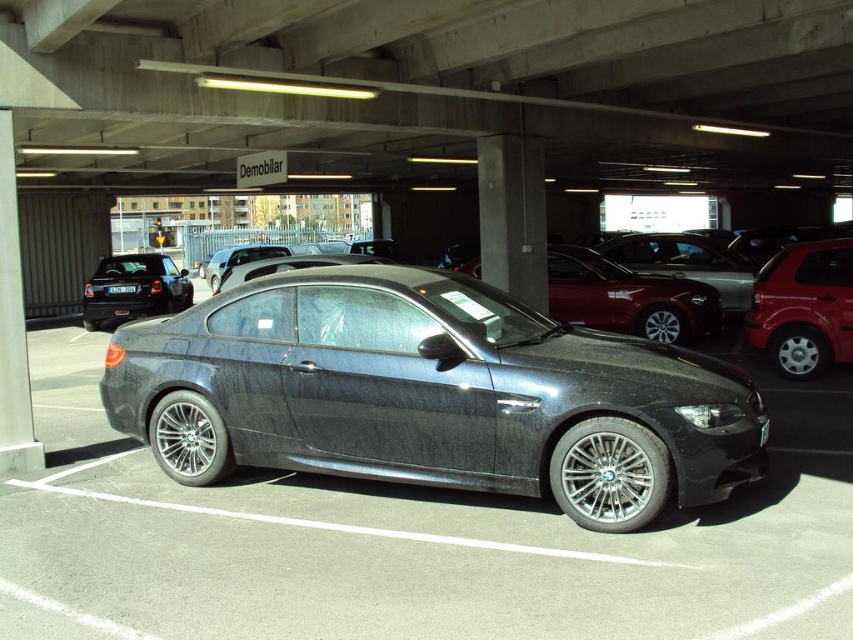
Question: Which object appears closest to the camera in this image?

Choices:
 (A) metallic red sedan at center
 (B) black plastic license plate at center
 (C) metallic red hatchback at right

Answer: (C)

Question: Which point is closer to the camera?

Choices:
 (A) (689, 316)
 (B) (790, 276)
 (C) (109, 284)
 (D) (173, 269)

Answer: (B)

Question: Estimate the real-world distances between objects in this image. Which object is farther from the metallic red hatchback at right?

Choices:
 (A) matte black sedan at left
 (B) black plastic license plate at center

Answer: (A)

Question: Can you confirm if matte black sedan at left is thinner than black plastic license plate at center?

Choices:
 (A) no
 (B) yes

Answer: (A)

Question: Is metallic red hatchback at right thinner than matte black sedan at left?

Choices:
 (A) no
 (B) yes

Answer: (B)

Question: Can you confirm if metallic gray car at center is positioned above black plastic license plate at center?

Choices:
 (A) yes
 (B) no

Answer: (B)